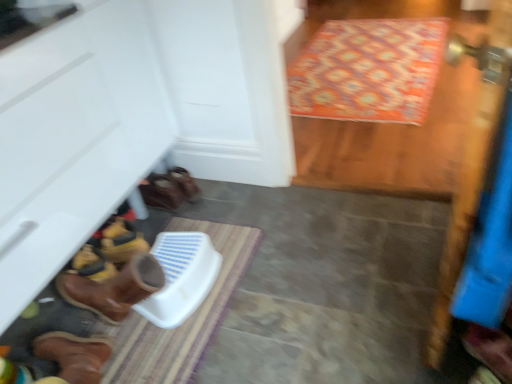
Question: Does brown leather boot at lower left, which appears as the 2th footwear when viewed from the back, have a larger size compared to brown leather boot at lower left, the 2th footwear viewed from the right?

Choices:
 (A) yes
 (B) no

Answer: (B)

Question: From the image's perspective, is brown leather boot at lower left, which is the first footwear in bottom-to-top order, under brown leather boot at lower left, the 2th footwear viewed from the right?

Choices:
 (A) no
 (B) yes

Answer: (B)

Question: From a real-world perspective, is brown leather boot at lower left, which is the first footwear in bottom-to-top order, on brown leather boot at lower left, positioned as the 1th footwear in left-to-right order?

Choices:
 (A) no
 (B) yes

Answer: (A)

Question: Is brown leather boot at lower left, the 2th footwear in the top-to-bottom sequence, not near brown leather boot at lower left, positioned as the 1th footwear in left-to-right order?

Choices:
 (A) no
 (B) yes

Answer: (B)

Question: Could you tell me if brown leather boot at lower left, which is the first footwear in bottom-to-top order, is turned towards brown leather boot at lower left, which is counted as the 2th footwear, starting from the bottom?

Choices:
 (A) no
 (B) yes

Answer: (A)

Question: Considering the relative sizes of brown leather boot at lower left, acting as the first footwear starting from the right, and brown leather boot at lower left, which is counted as the 2th footwear, starting from the bottom, in the image provided, is brown leather boot at lower left, acting as the first footwear starting from the right, smaller than brown leather boot at lower left, which is counted as the 2th footwear, starting from the bottom,?

Choices:
 (A) no
 (B) yes

Answer: (B)

Question: Is striped fabric doormat at lower center, placed as the first doormat when sorted from front to back, positioned far away from patterned fabric doormat at upper right, arranged as the first doormat when viewed from the top?

Choices:
 (A) no
 (B) yes

Answer: (B)

Question: Considering the relative positions of striped fabric doormat at lower center, placed as the first doormat when sorted from front to back, and patterned fabric doormat at upper right, which ranks as the 2th doormat in front-to-back order, in the image provided, is striped fabric doormat at lower center, placed as the first doormat when sorted from front to back, to the left of patterned fabric doormat at upper right, which ranks as the 2th doormat in front-to-back order, from the viewer's perspective?

Choices:
 (A) yes
 (B) no

Answer: (A)

Question: Is striped fabric doormat at lower center, the first doormat when ordered from bottom to top, looking in the opposite direction of patterned fabric doormat at upper right, which is the 1th doormat in back-to-front order?

Choices:
 (A) yes
 (B) no

Answer: (B)

Question: Is striped fabric doormat at lower center, arranged as the 2th doormat when viewed from the top, closer to camera compared to patterned fabric doormat at upper right, arranged as the first doormat when viewed from the top?

Choices:
 (A) no
 (B) yes

Answer: (B)

Question: From a real-world perspective, is striped fabric doormat at lower center, arranged as the 2th doormat when viewed from the top, over patterned fabric doormat at upper right, arranged as the first doormat when viewed from the top?

Choices:
 (A) yes
 (B) no

Answer: (B)

Question: Is striped fabric doormat at lower center, which appears as the first doormat when viewed from the left, aimed at patterned fabric doormat at upper right, acting as the 1th doormat starting from the right?

Choices:
 (A) no
 (B) yes

Answer: (A)

Question: Is brown leather boot at lower left, placed as the second footwear when sorted from left to right, smaller than patterned fabric doormat at upper right, acting as the second doormat starting from the left?

Choices:
 (A) yes
 (B) no

Answer: (A)